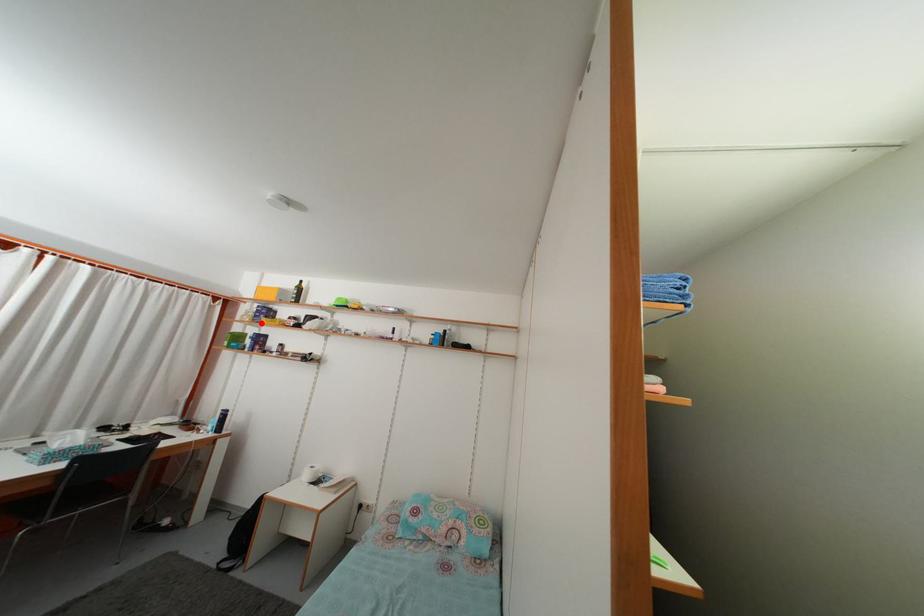
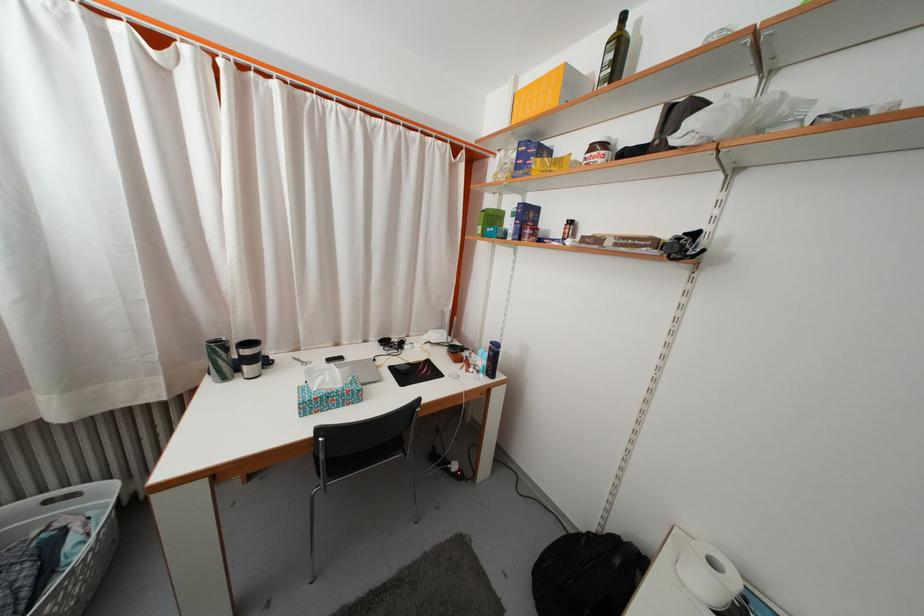
Question: A red point is marked in image1. In image2, is the corresponding 3D point closer to the camera or farther? Reply with the corresponding letter.

Choices:
 (A) The corresponding 3D point is closer.
 (B) The corresponding 3D point is farther.

Answer: (A)